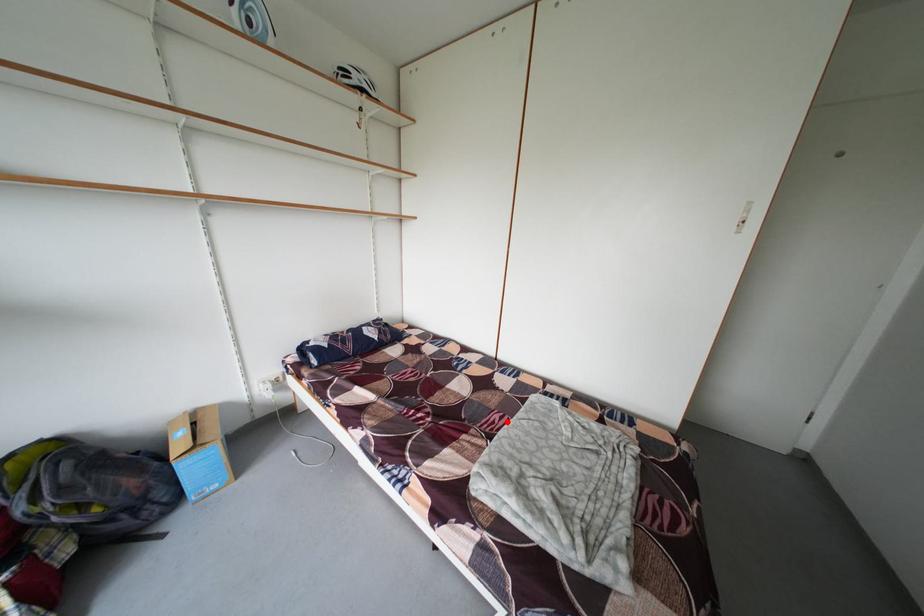
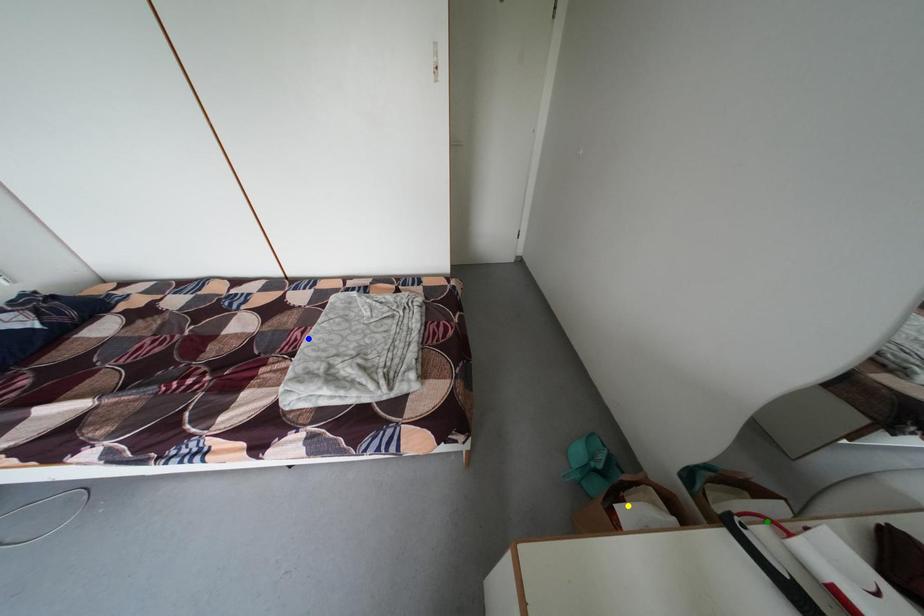
Question: I am providing you with two images of the same scene from different viewpoints. A red point is marked on the first image. You are given multiple points on the second image. Which mark in image 2 goes with the point in image 1?

Choices:
 (A) green point
 (B) blue point
 (C) yellow point

Answer: (B)